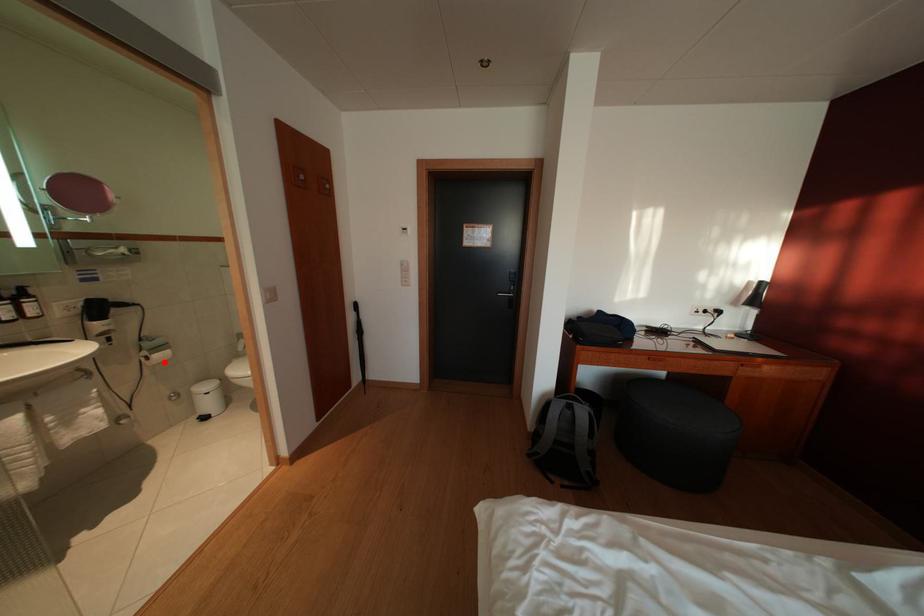
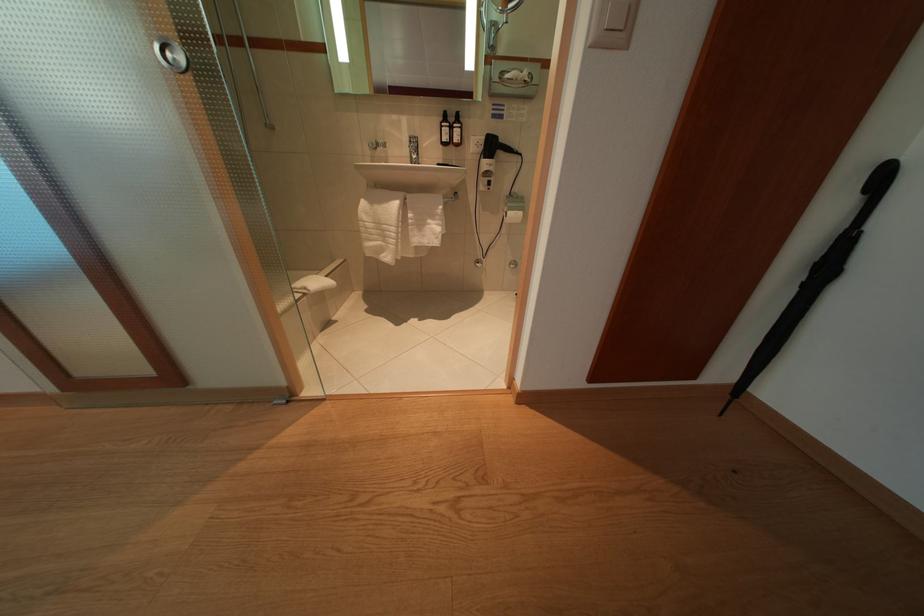
Question: I am providing you with two images of the same scene from different viewpoints. A red point is marked on the first image. Can you still see the location of the red point in image 2?

Choices:
 (A) Yes
 (B) No

Answer: (A)